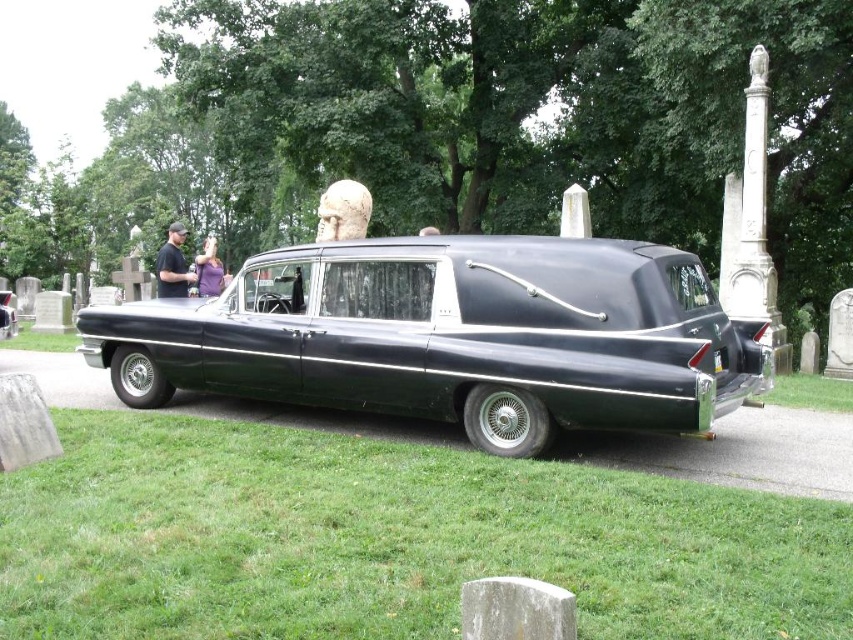
Who is higher up, glossy black hearse at center or purple fabric at center?

purple fabric at center is above.

Is point (550, 259) more distant than point (219, 268)?

No, (550, 259) is closer to viewer.

I want to click on glossy black hearse at center, so coord(451,337).

Does point (169, 250) come in front of point (219, 282)?

Yes, point (169, 250) is closer to viewer.

Is point (163, 296) more distant than point (218, 288)?

No, it is not.

In order to click on black leather jacket at center in this screenshot , I will do click(173, 264).

I want to click on black leather jacket at center, so click(x=173, y=264).

Is glossy black hearse at center bigger than black leather jacket at center?

No.

Does glossy black hearse at center appear over black leather jacket at center?

Actually, glossy black hearse at center is below black leather jacket at center.

Between point (587, 394) and point (169, 243), which one is positioned in front?

Point (587, 394) is more forward.

Where is `glossy black hearse at center`? The width and height of the screenshot is (853, 640). glossy black hearse at center is located at coordinates pos(451,337).